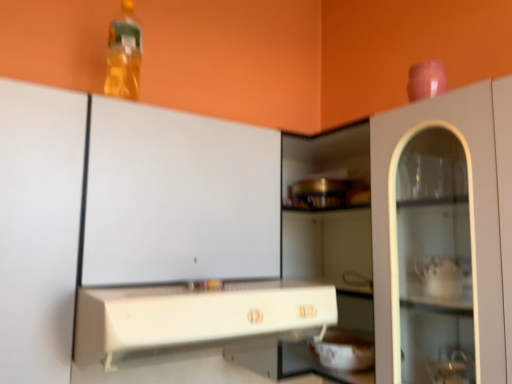
Question: Choose the correct answer: Is translucent plastic bottle at upper left inside white glossy bowl at lower center or outside it?

Choices:
 (A) inside
 (B) outside

Answer: (B)

Question: From a real-world perspective, is translucent plastic bottle at upper left above or below white glossy bowl at lower center?

Choices:
 (A) above
 (B) below

Answer: (A)

Question: Which is farther from the translucent plastic bottle at upper left?

Choices:
 (A) white glossy bowl at lower center
 (B) white plastic countertop at center

Answer: (A)

Question: Which object is positioned closest to the translucent plastic bottle at upper left?

Choices:
 (A) white glossy bowl at lower center
 (B) white plastic countertop at center

Answer: (B)